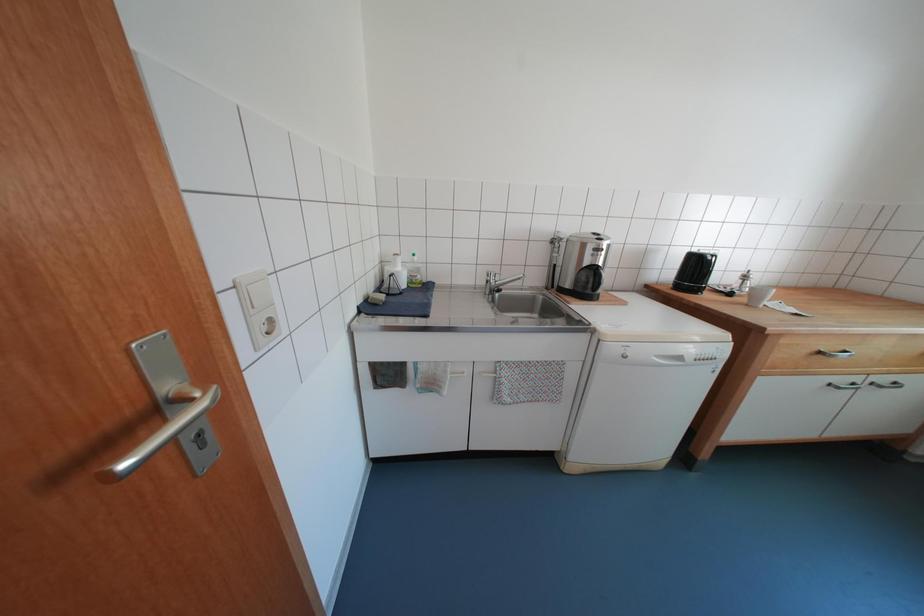
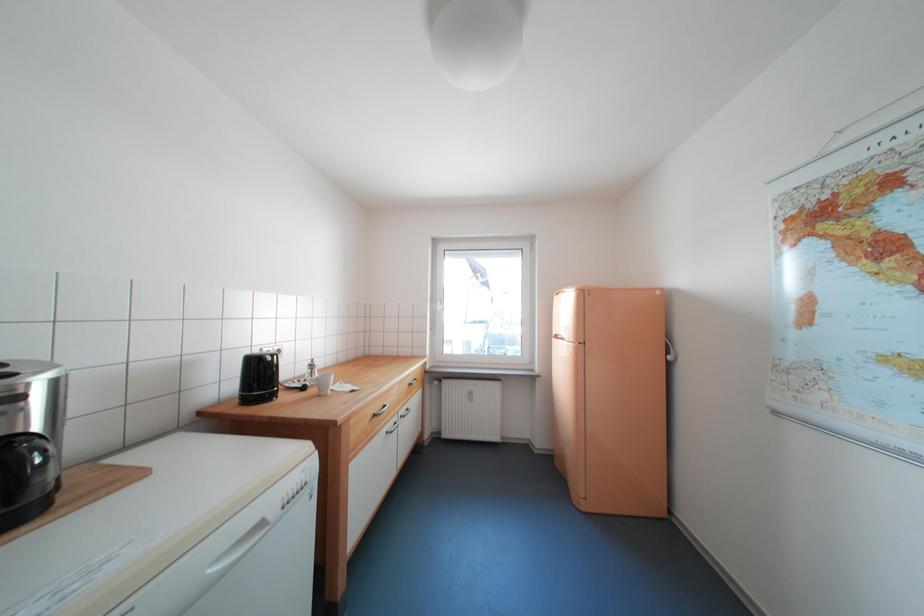
Question: Based on the continuous images, in which direction is the camera rotating? Reply with the corresponding letter.

Choices:
 (A) Left
 (B) Right
 (C) Up
 (D) Down

Answer: (B)